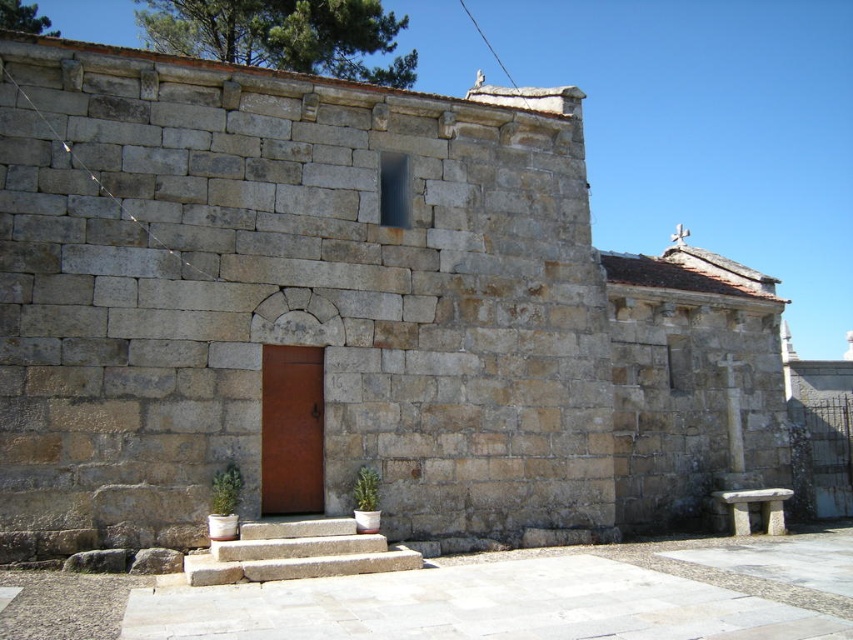
You are standing at point A, which is located at coordinates (296, 552). What object is located at this point?

The natural stone stairs at center are located at point A, which is at coordinates (296, 552).

You are standing in front of a historical stone structure and want to reach the entrance. The entrance is located at the top of the natural stone stairs at center. If your maximum comfortable walking distance is 60 feet, will you need to stop and rest before reaching the entrance?

The natural stone stairs at center is 61.54 feet away from viewer. Since this distance exceeds your maximum comfortable walking distance of 60 feet, you will need to stop and rest before reaching the entrance.

You are standing at the entrance of the stone structure and need to reach the rusty metal door at center. The natural stone stairs at center are in your path. Are the stairs higher than the door?

The natural stone stairs at center has a lesser height compared to rusty metal door at center, so the stairs are not higher than the door.